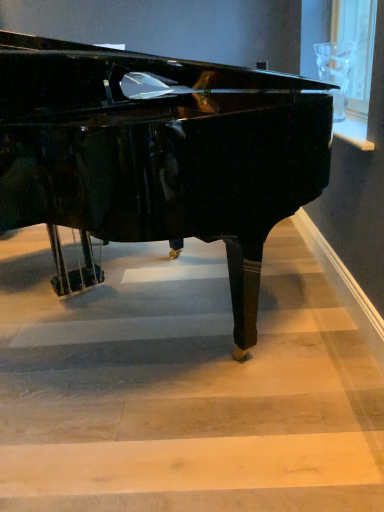
Image resolution: width=384 pixels, height=512 pixels. What do you see at coordinates (356, 48) in the screenshot?
I see `transparent glass at upper right` at bounding box center [356, 48].

Identify the location of transparent glass at upper right. (356, 48).

Is transparent glass at upper right positioned beyond the bounds of glossy black piano at center?

Yes, transparent glass at upper right is located beyond the bounds of glossy black piano at center.

Is glossy black piano at center at the back of transparent glass at upper right?

No, transparent glass at upper right is not facing the opposite direction of glossy black piano at center.

This screenshot has width=384, height=512. In the image, there is a transparent glass at upper right. What are the coordinates of `piano below it (from a real-world perspective)` in the screenshot? It's located at (157, 154).

How many degrees apart are the facing directions of transparent glass at upper right and glossy black piano at center?

They differ by 52.8 degrees in their facing directions.

Where is `piano above the wooden stairwell at center (from a real-world perspective)`? Image resolution: width=384 pixels, height=512 pixels. piano above the wooden stairwell at center (from a real-world perspective) is located at coordinates point(157,154).

Is wooden stairwell at center not close to glossy black piano at center?

No, there isn't a large distance between wooden stairwell at center and glossy black piano at center.

Consider the image. Is wooden stairwell at center facing towards glossy black piano at center?

No, wooden stairwell at center is not aimed at glossy black piano at center.

Considering the positions of point (131, 450) and point (24, 202), is point (131, 450) closer or farther from the camera than point (24, 202)?

Clearly, point (131, 450) is closer to the camera than point (24, 202).

Is wooden stairwell at center thinner than transparent glass at upper right?

Incorrect, the width of wooden stairwell at center is not less than that of transparent glass at upper right.

Is wooden stairwell at center taller or shorter than transparent glass at upper right?

Clearly, wooden stairwell at center is shorter compared to transparent glass at upper right.

Is wooden stairwell at center directly adjacent to transparent glass at upper right?

No, wooden stairwell at center is not touching transparent glass at upper right.

In the scene shown: Does transparent glass at upper right turn towards wooden stairwell at center?

No.

Who is more distant, transparent glass at upper right or wooden stairwell at center?

transparent glass at upper right is more distant.

Can you tell me how much transparent glass at upper right and wooden stairwell at center differ in facing direction?

The facing directions of transparent glass at upper right and wooden stairwell at center are 89.3 degrees apart.

Is transparent glass at upper right placed right next to wooden stairwell at center?

There is a gap between transparent glass at upper right and wooden stairwell at center.

From the picture: Which object is positioned more to the left, glossy black piano at center or transparent glass at upper right?

From the viewer's perspective, glossy black piano at center appears more on the left side.

Is glossy black piano at center turned away from transparent glass at upper right?

No, glossy black piano at center is not facing away from transparent glass at upper right.

Does glossy black piano at center have a larger size compared to wooden stairwell at center?

Yes.

How many degrees apart are the facing directions of glossy black piano at center and wooden stairwell at center?

The angular difference between glossy black piano at center and wooden stairwell at center is 36.5 degrees.

Does point (273, 86) appear closer or farther from the camera than point (13, 468)?

Point (273, 86) is positioned farther from the camera compared to point (13, 468).

At what (x,y) coordinates should I click in order to perform the action: click on piano that is in front of the transparent glass at upper right. Please return your answer as a coordinate pair (x, y). The height and width of the screenshot is (512, 384). Looking at the image, I should click on (157, 154).

The height and width of the screenshot is (512, 384). In order to click on piano on the left of wooden stairwell at center in this screenshot , I will do `click(157, 154)`.

Which object lies nearer to the anchor point wooden stairwell at center, transparent glass at upper right or glossy black piano at center?

Based on the image, glossy black piano at center appears to be nearer to wooden stairwell at center.

From the picture: Estimate the real-world distances between objects in this image. Which object is closer to transparent glass at upper right, glossy black piano at center or wooden stairwell at center?

glossy black piano at center.

Consider the image. Estimate the real-world distances between objects in this image. Which object is closer to glossy black piano at center, wooden stairwell at center or transparent glass at upper right?

wooden stairwell at center is closer to glossy black piano at center.

Looking at this image, which object lies further to the anchor point glossy black piano at center, transparent glass at upper right or wooden stairwell at center?

transparent glass at upper right lies further to glossy black piano at center than the other object.

Estimate the real-world distances between objects in this image. Which object is closer to wooden stairwell at center, glossy black piano at center or transparent glass at upper right?

glossy black piano at center is positioned closer to the anchor wooden stairwell at center.

Considering their positions, is wooden stairwell at center positioned closer to transparent glass at upper right than glossy black piano at center?

Among the two, glossy black piano at center is located nearer to transparent glass at upper right.

Identify the location of piano between transparent glass at upper right and wooden stairwell at center in the vertical direction. (157, 154).